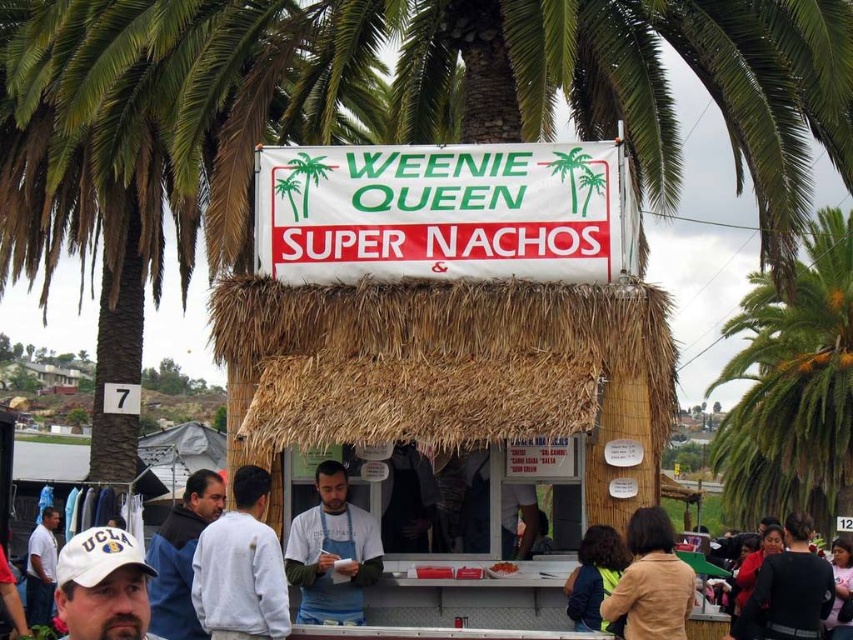
Does white fabric sign at center have a greater width compared to white fleece jacket at lower left?

Yes.

Describe the element at coordinates (444, 212) in the screenshot. The height and width of the screenshot is (640, 853). I see `white fabric sign at center` at that location.

Who is more distant from viewer, (538,221) or (257,609)?

The point (538,221) is behind.

You are a GUI agent. You are given a task and a screenshot of the screen. Output one action in this format:
    pyautogui.click(x=<x>, y=<y>)
    Task: Click on the white fabric sign at center
    
    Given the screenshot: What is the action you would take?
    pyautogui.click(x=444, y=212)

Is point (444, 269) positioned behind point (339, 545)?

Yes, it is.

The height and width of the screenshot is (640, 853). Describe the element at coordinates (444, 212) in the screenshot. I see `white fabric sign at center` at that location.

Identify the location of white fabric sign at center. (444, 212).

Is green leafy palm tree at upper center taller than white matte shirt at lower left?

Correct, green leafy palm tree at upper center is much taller as white matte shirt at lower left.

This screenshot has height=640, width=853. Describe the element at coordinates (793, 385) in the screenshot. I see `green leafy palm tree at upper center` at that location.

In order to click on green leafy palm tree at upper center in this screenshot , I will do `click(793, 385)`.